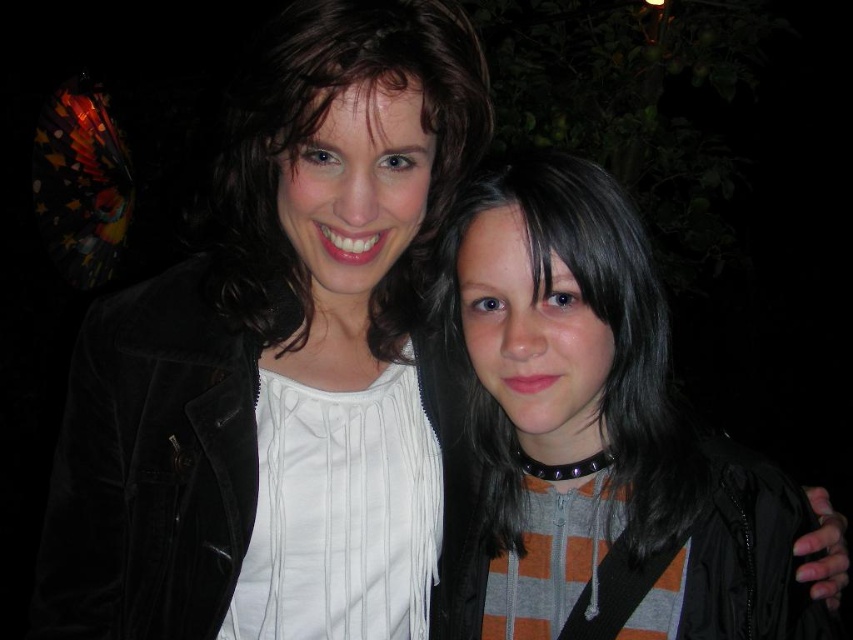
Question: Is orange striped hoodie at center thinner than matte black jacket at upper left?

Choices:
 (A) no
 (B) yes

Answer: (A)

Question: In this image, where is orange striped hoodie at center located relative to matte black jacket at upper left?

Choices:
 (A) right
 (B) left

Answer: (A)

Question: Can you confirm if orange striped hoodie at center is positioned to the left of matte black jacket at upper left?

Choices:
 (A) no
 (B) yes

Answer: (A)

Question: Which point is farther to the camera?

Choices:
 (A) (456, 246)
 (B) (482, 134)

Answer: (B)